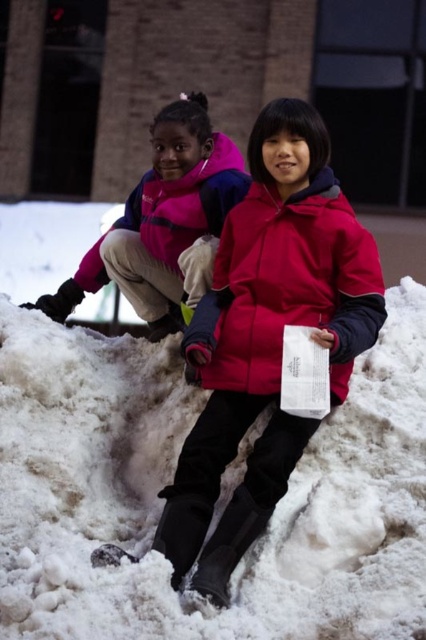
Question: Which of the following is the closest to the observer?

Choices:
 (A) matte red jacket at center
 (B) white fluffy snow at center
 (C) matte pink jacket at upper left

Answer: (B)

Question: Among these objects, which one is nearest to the camera?

Choices:
 (A) white fluffy snow at center
 (B) matte red jacket at center
 (C) matte pink jacket at upper left

Answer: (A)

Question: Which point appears farthest from the camera in this image?

Choices:
 (A) (339, 260)
 (B) (135, 611)

Answer: (A)

Question: Is white fluffy snow at center to the left of matte pink jacket at upper left from the viewer's perspective?

Choices:
 (A) no
 (B) yes

Answer: (A)

Question: Observing the image, what is the correct spatial positioning of white fluffy snow at center in reference to matte pink jacket at upper left?

Choices:
 (A) below
 (B) above

Answer: (A)

Question: Can you confirm if white fluffy snow at center is positioned to the left of matte red jacket at center?

Choices:
 (A) yes
 (B) no

Answer: (B)